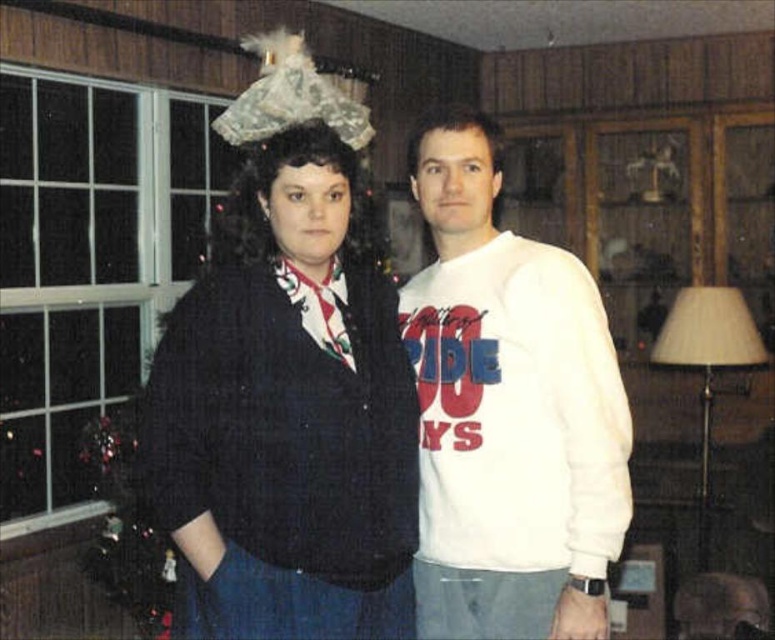
You are organizing a clothing donation drive and need to determine which of the two garments, the black knitted sweater at center or the white cotton sweatshirt at center, takes up more space in the donation box. Based on their sizes, which one should you place first to optimize space?

The black knitted sweater at center is bigger than the white cotton sweatshirt at center, so you should place the white cotton sweatshirt at center first to optimize space by filling smaller gaps with smaller items.

You are taking a photo of two points in an image. The first point is at coordinate point (153, 456) and the second is at point (486, 486). Which point will appear larger in your photo?

Point (153, 456) is closer to the camera than point (486, 486), so it will appear larger in the photo.

You are a tailor measuring the distance between two garments. You have a measuring tape that can only measure up to 25 centimeters. Can you accurately measure the distance between the black knitted sweater at center and the white cotton sweatshirt at center using your tape?

The distance between the black knitted sweater at center and the white cotton sweatshirt at center is 26.88 centimeters. Since your measuring tape can only go up to 25 centimeters, you cannot accurately measure the full distance between them with this tool.